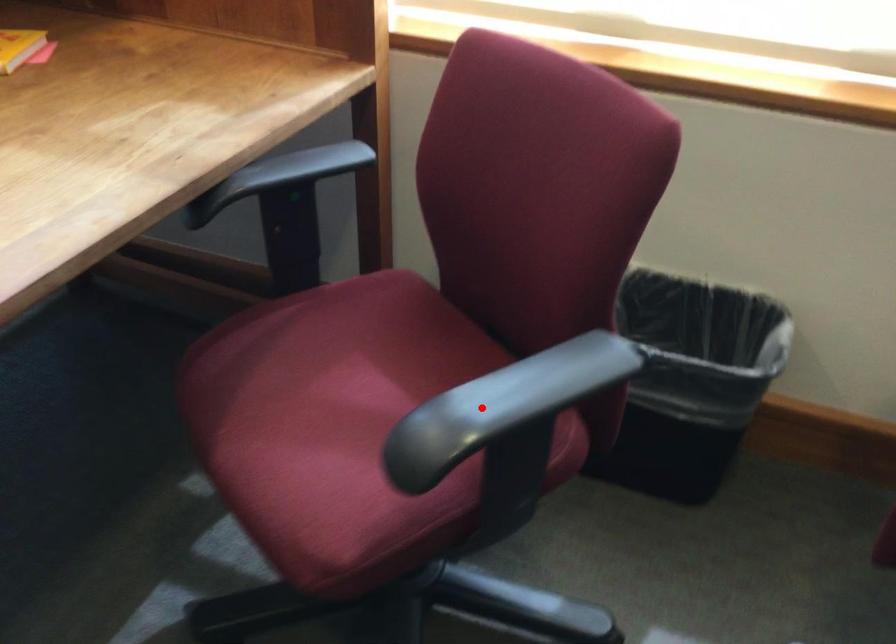
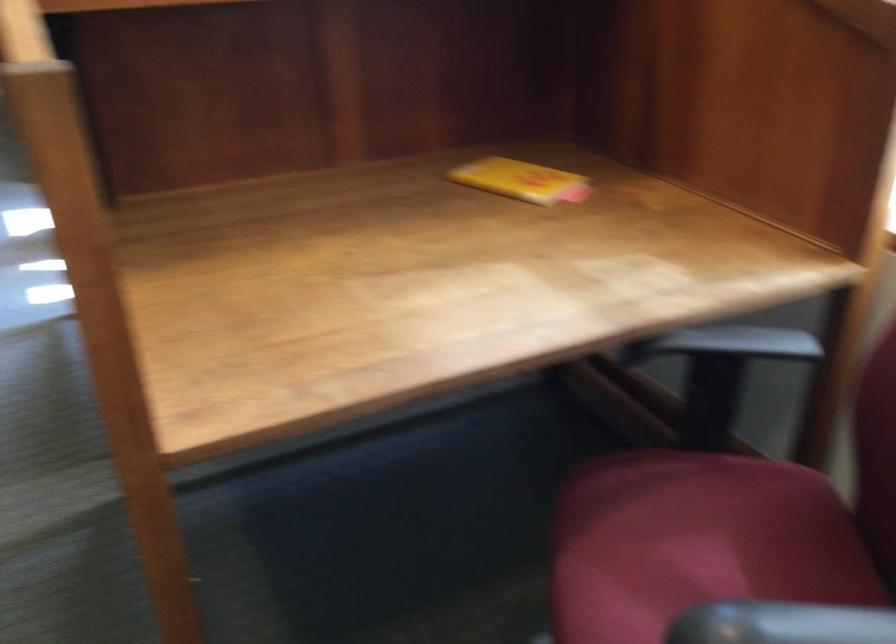
Question: I am providing you with two images of the same scene from different viewpoints. A red point is marked on the first image. Is the red point's position out of view in image 2?

Choices:
 (A) Yes
 (B) No

Answer: (B)